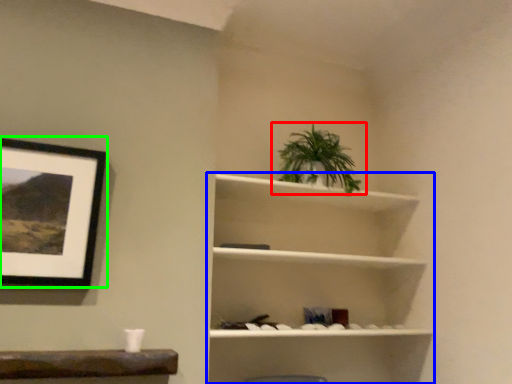
Question: Which is nearer to the houseplant (highlighted by a red box)? shelf (highlighted by a blue box) or picture frame (highlighted by a green box).

Choices:
 (A) shelf
 (B) picture frame

Answer: (A)